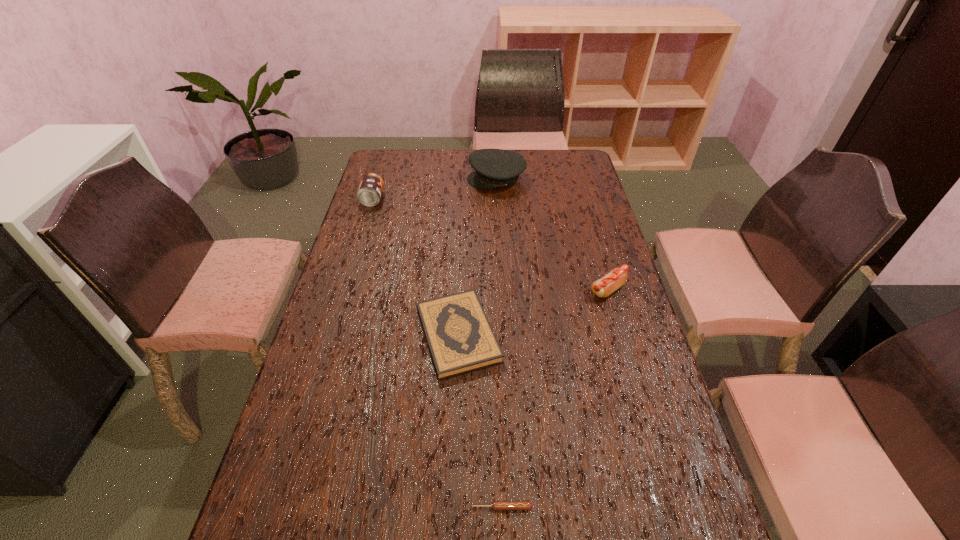
In the image, there is a desktop. Where is `vacant space at the right edge`? Image resolution: width=960 pixels, height=540 pixels. vacant space at the right edge is located at coordinates (635, 415).

Locate an element on the screen. free point at the far right corner is located at coordinates (568, 166).

This screenshot has height=540, width=960. I want to click on free spot between the beret and the hardback book, so click(x=477, y=257).

Locate an element on the screen. This screenshot has height=540, width=960. empty location between the shortest object and the fourth tallest object is located at coordinates (480, 421).

Locate an element on the screen. This screenshot has width=960, height=540. vacant area that lies between the fourth tallest object and the beret is located at coordinates (477, 257).

Where is `vacant region between the second shortest object and the shortest object`? This screenshot has height=540, width=960. vacant region between the second shortest object and the shortest object is located at coordinates (480, 421).

Identify the location of empty space between the leftmost object and the fourth tallest object. The height and width of the screenshot is (540, 960). (416, 267).

The height and width of the screenshot is (540, 960). Identify the location of unoccupied position between the nearer sausage and the rightmost object. (555, 399).

At what (x,y) coordinates should I click in order to perform the action: click on unoccupied position between the rightmost object and the nearest object. Please return your answer as a coordinate pair (x, y). Looking at the image, I should click on pos(555,399).

Image resolution: width=960 pixels, height=540 pixels. I want to click on free spot between the hardback book and the beret, so click(x=477, y=257).